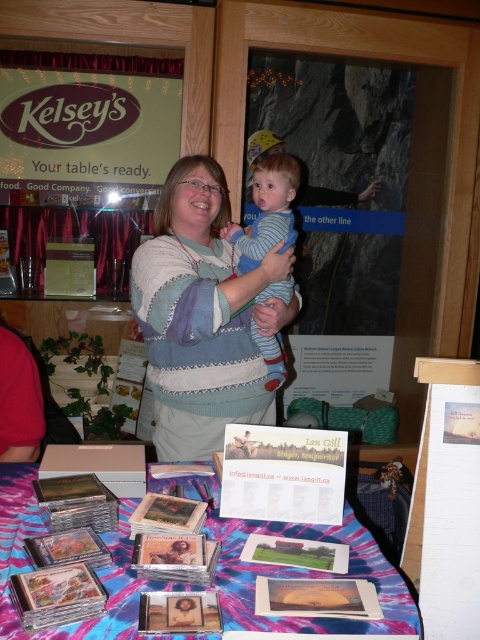
You are organizing a clothing donation drive and need to determine if the knitted sweater at center and the striped cotton shirt at center can fit into a box that can hold items up to 15 inches in height. Given their sizes, will both items fit?

The knitted sweater at center is larger in size than the striped cotton shirt at center. However, without specific measurements, it is impossible to determine if both items will fit into the box. Please provide more details about their exact dimensions.